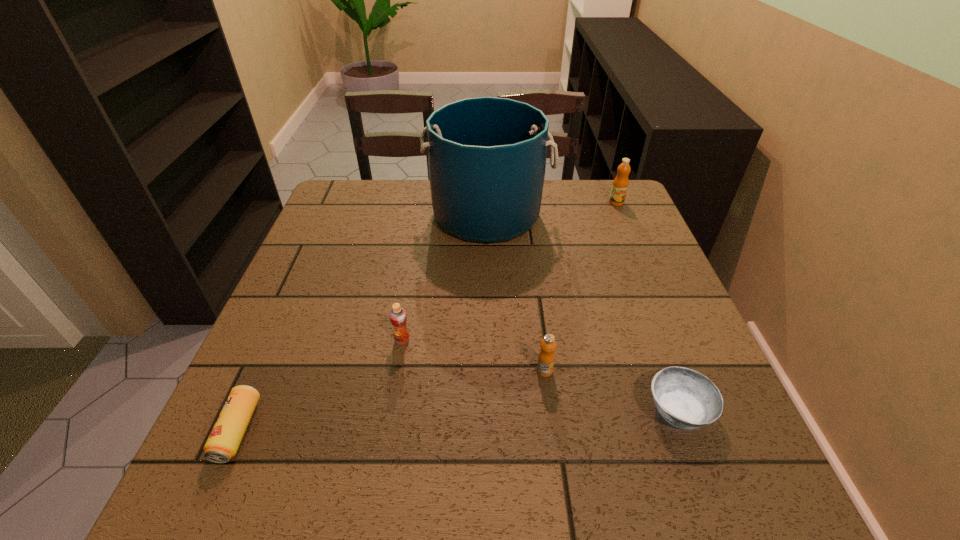
This screenshot has width=960, height=540. What are the coordinates of `the tallest object` in the screenshot? It's located at (486, 155).

Locate an element on the screen. the second tallest object is located at coordinates (620, 184).

Where is `the farthest orange juice`? Image resolution: width=960 pixels, height=540 pixels. the farthest orange juice is located at coordinates (620, 184).

The width and height of the screenshot is (960, 540). Identify the location of the leftmost orange juice. coord(398,317).

Identify the location of the second farthest orange juice. The width and height of the screenshot is (960, 540). (398, 317).

Find the location of `the second orange juice from right to left`. the second orange juice from right to left is located at coordinates (546, 357).

At what (x,y) coordinates should I click in order to perform the action: click on the third nearest object. Please return your answer as a coordinate pair (x, y). The image size is (960, 540). Looking at the image, I should click on (546, 357).

The height and width of the screenshot is (540, 960). Identify the location of ashtray. (685, 398).

Where is `beer can`? Image resolution: width=960 pixels, height=540 pixels. beer can is located at coordinates click(222, 444).

Where is `free space located 0.100m on the front of the tallest object`? This screenshot has height=540, width=960. free space located 0.100m on the front of the tallest object is located at coordinates (489, 274).